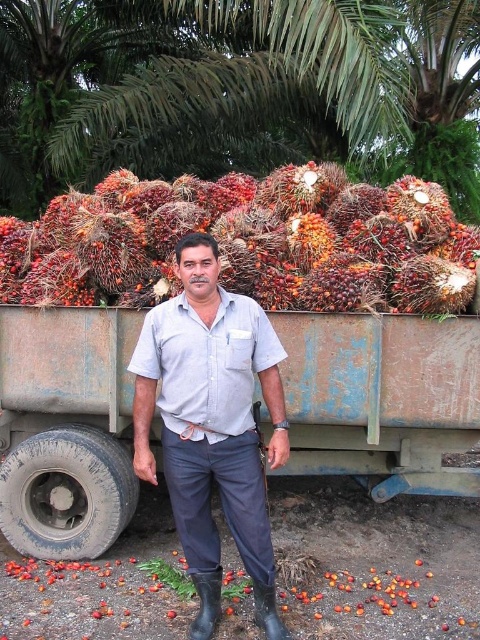
You need to transport both the rusty metal wagon at center and the rustic brown coconuts at center using a small cart that can carry items up to 1 meter in width. Which item should you load first to ensure both fit?

The rusty metal wagon at center is smaller than rustic brown coconuts at center, so you should load the rusty metal wagon at center first to ensure both fit within the cart.

You are a farmer who wants to move the rusty metal wagon at center closer to the green leafy palm at upper center. Which direction should you push the wagon to align it with the palm?

You should push the rusty metal wagon at center to the right to align it with the green leafy palm at upper center since the wagon is currently to the left of the palm.